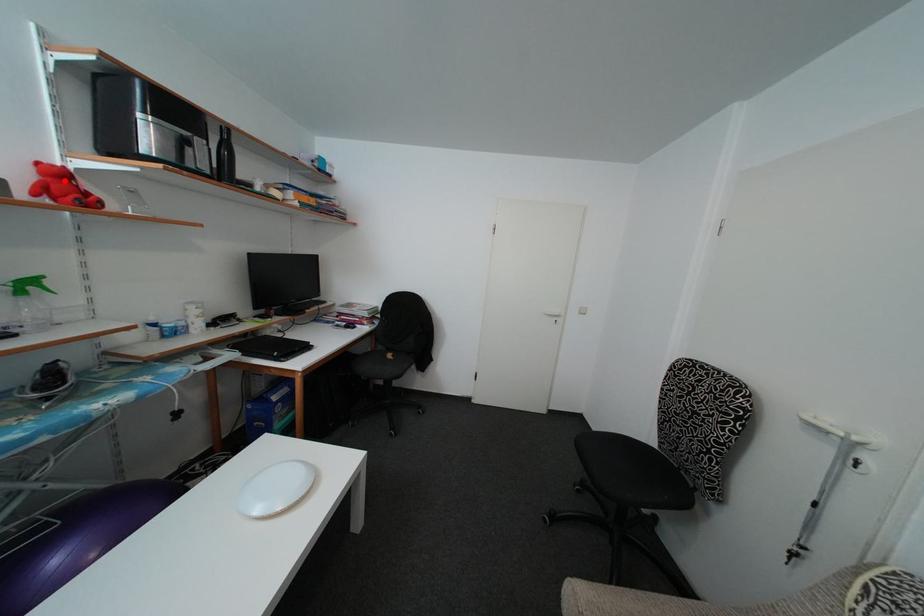
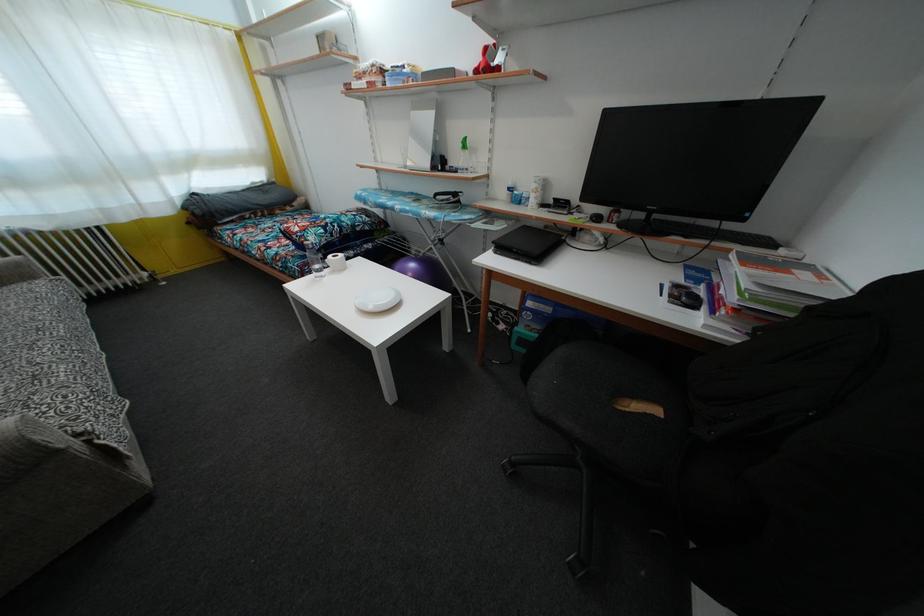
The point at the highlighted location is marked in the first image. Where is the corresponding point in the second image?

(490, 58)